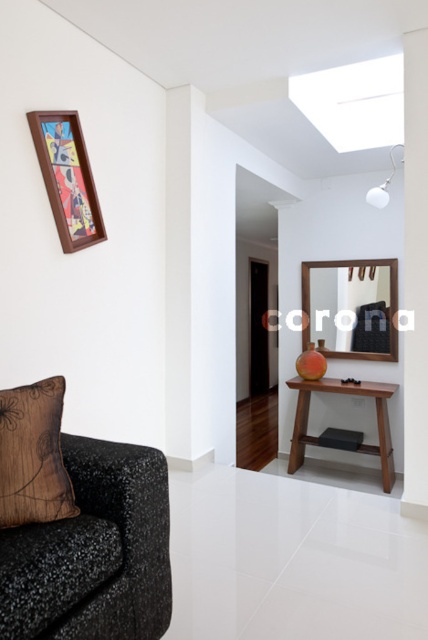
You are standing in the room and want to hang a new picture frame on the wall. The wooden picture frame at upper left is currently hanging there. If you move it to the spot where the mahogany wood console table at center is located, will it be closer to you or farther away?

The wooden picture frame at upper left is currently closer to the viewer than the mahogany wood console table at center. If you move it to the console table location, it would be farther away from you than its current position.

You are a delivery person placing a small package between the black speckled fabric couch at lower left and the brown textured pillow at lower left. Can you fit the package if it requires 8 inches of space?

The distance between the black speckled fabric couch at lower left and the brown textured pillow at lower left is 7.40 inches, which is less than the required 8 inches. Therefore, the package cannot be placed there.